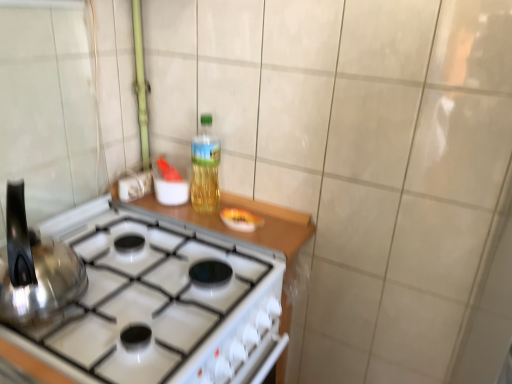
Question: Is translucent plastic bottle at center located within white glossy gas stove at center?

Choices:
 (A) yes
 (B) no

Answer: (B)

Question: From the image's perspective, is white glossy gas stove at center located beneath translucent plastic bottle at center?

Choices:
 (A) yes
 (B) no

Answer: (A)

Question: From a real-world perspective, is white glossy gas stove at center on top of translucent plastic bottle at center?

Choices:
 (A) yes
 (B) no

Answer: (B)

Question: Does white glossy gas stove at center have a greater width compared to translucent plastic bottle at center?

Choices:
 (A) no
 (B) yes

Answer: (B)

Question: Is white glossy gas stove at center facing towards translucent plastic bottle at center?

Choices:
 (A) no
 (B) yes

Answer: (A)

Question: Is white glossy gas stove at center touching translucent plastic bottle at center?

Choices:
 (A) yes
 (B) no

Answer: (B)

Question: Is white glossy gas stove at center bigger than satin silver kettle at left?

Choices:
 (A) yes
 (B) no

Answer: (A)

Question: Is white glossy gas stove at center positioned far away from satin silver kettle at left?

Choices:
 (A) no
 (B) yes

Answer: (A)

Question: From the image's perspective, does white glossy gas stove at center appear lower than satin silver kettle at left?

Choices:
 (A) yes
 (B) no

Answer: (A)

Question: From a real-world perspective, is white glossy gas stove at center positioned under satin silver kettle at left based on gravity?

Choices:
 (A) no
 (B) yes

Answer: (B)

Question: Can you confirm if white glossy gas stove at center is shorter than satin silver kettle at left?

Choices:
 (A) yes
 (B) no

Answer: (B)

Question: From the image's perspective, is white glossy gas stove at center on satin silver kettle at left?

Choices:
 (A) yes
 (B) no

Answer: (B)

Question: From a real-world perspective, is translucent plastic bottle at center located beneath satin silver kettle at left?

Choices:
 (A) no
 (B) yes

Answer: (A)